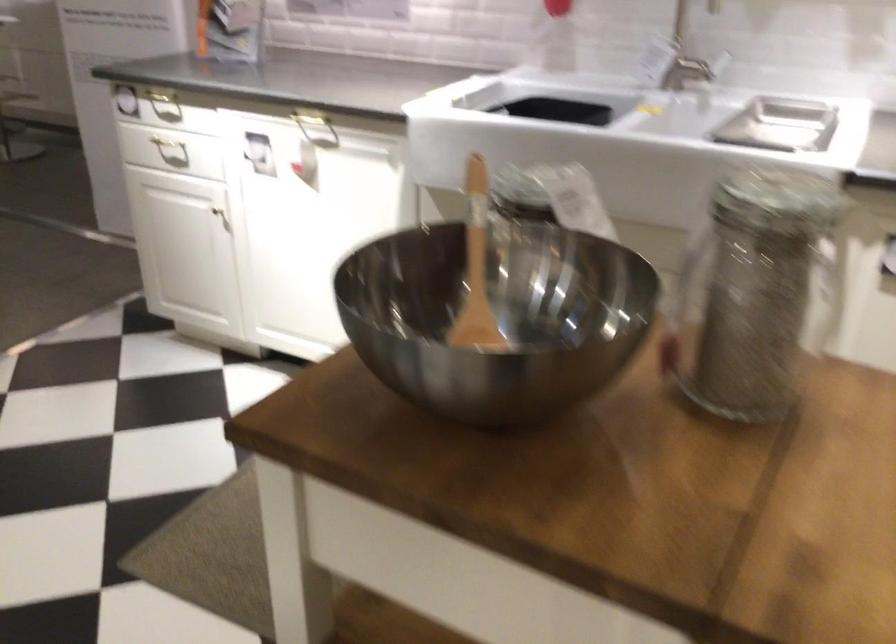
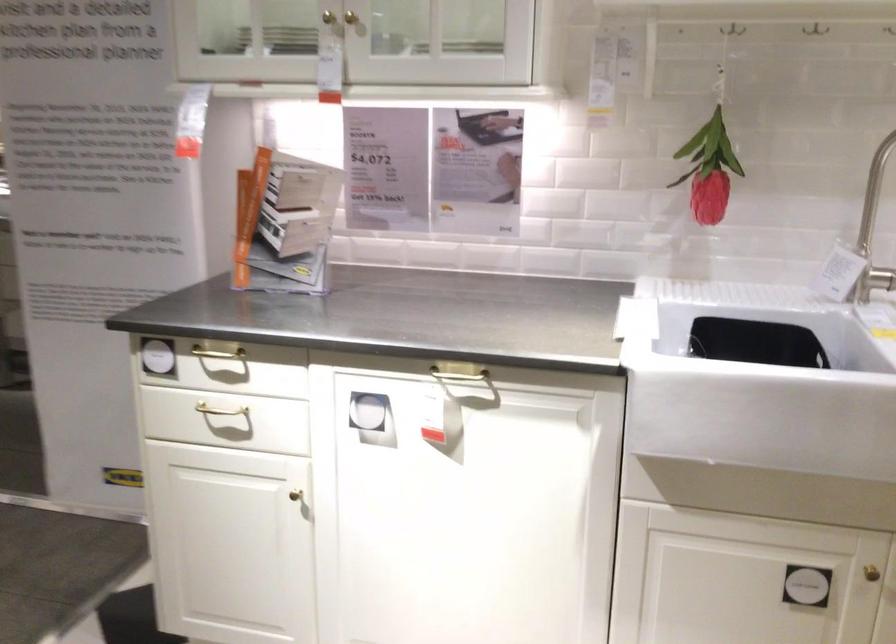
Find the pixel in the second image that matches point 681,71 in the first image.

(880, 278)